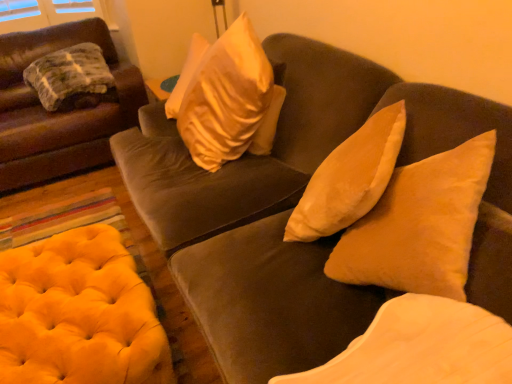
Question: Would you say yellow tufted ottoman at lower left is part of velvet beige pillow at center, the first pillow from the front,'s contents?

Choices:
 (A) no
 (B) yes

Answer: (A)

Question: Does velvet beige pillow at center, positioned as the 1th pillow in bottom-to-top order, have a greater height compared to yellow tufted ottoman at lower left?

Choices:
 (A) no
 (B) yes

Answer: (B)

Question: Considering the relative sizes of velvet beige pillow at center, the first pillow from the front, and yellow tufted ottoman at lower left in the image provided, is velvet beige pillow at center, the first pillow from the front, bigger than yellow tufted ottoman at lower left?

Choices:
 (A) no
 (B) yes

Answer: (A)

Question: Considering the relative positions of velvet beige pillow at center, which is counted as the 3th pillow, starting from the back, and yellow tufted ottoman at lower left in the image provided, is velvet beige pillow at center, which is counted as the 3th pillow, starting from the back, in front of yellow tufted ottoman at lower left?

Choices:
 (A) yes
 (B) no

Answer: (A)

Question: Considering the relative sizes of velvet beige pillow at center, which is counted as the 3th pillow, starting from the back, and yellow tufted ottoman at lower left in the image provided, is velvet beige pillow at center, which is counted as the 3th pillow, starting from the back, smaller than yellow tufted ottoman at lower left?

Choices:
 (A) yes
 (B) no

Answer: (A)

Question: Considering the positions of point (78, 74) and point (382, 375), is point (78, 74) closer or farther from the camera than point (382, 375)?

Choices:
 (A) farther
 (B) closer

Answer: (A)

Question: Considering the positions of green textured blanket at left, the first pillow viewed from the left, and velvet beige pillow at center, the 3th pillow in the top-to-bottom sequence, in the image, is green textured blanket at left, the first pillow viewed from the left, bigger or smaller than velvet beige pillow at center, the 3th pillow in the top-to-bottom sequence,?

Choices:
 (A) big
 (B) small

Answer: (A)

Question: Looking at their shapes, would you say green textured blanket at left, marked as the 3th pillow in a bottom-to-top arrangement, is wider or thinner than velvet beige pillow at center, the second pillow viewed from the left?

Choices:
 (A) wide
 (B) thin

Answer: (A)

Question: From the image's perspective, is green textured blanket at left, the first pillow viewed from the left, positioned above or below velvet beige pillow at center, the 3th pillow in the top-to-bottom sequence?

Choices:
 (A) below
 (B) above

Answer: (B)

Question: From a real-world perspective, relative to green textured blanket at left, acting as the 3th pillow starting from the right, is velvet brown couch at center, the 1th studio couch in the right-to-left sequence, vertically above or below?

Choices:
 (A) below
 (B) above

Answer: (A)

Question: Is velvet brown couch at center, the 1th studio couch in the right-to-left sequence, taller or shorter than green textured blanket at left, the 1th pillow from the back?

Choices:
 (A) tall
 (B) short

Answer: (A)

Question: Would you say velvet brown couch at center, the 2th studio couch when ordered from left to right, is inside or outside green textured blanket at left, which is the third pillow in front-to-back order?

Choices:
 (A) inside
 (B) outside

Answer: (B)

Question: From the image's perspective, is velvet brown couch at center, the 2th studio couch when ordered from left to right, above or below green textured blanket at left, acting as the 3th pillow starting from the right?

Choices:
 (A) below
 (B) above

Answer: (A)

Question: From a real-world perspective, is suede beige pillow at center, which is the second pillow from front to back, positioned above or below velvet beige pillow at center, the second pillow viewed from the left?

Choices:
 (A) above
 (B) below

Answer: (A)

Question: In terms of height, does suede beige pillow at center, the third pillow viewed from the left, look taller or shorter compared to velvet beige pillow at center, the 2th pillow viewed from the right?

Choices:
 (A) tall
 (B) short

Answer: (A)